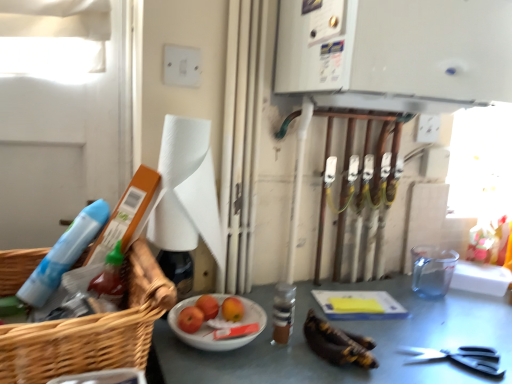
Find the location of `vacant space to the right of brown glass bottle at center`. vacant space to the right of brown glass bottle at center is located at coordinates (361, 336).